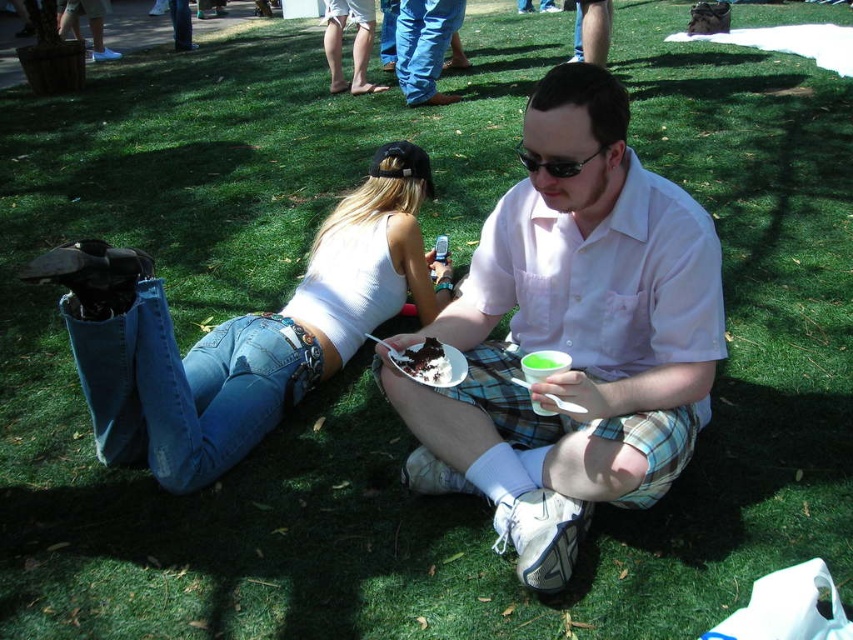
You are standing at the origin point of the coordinate system. You need to place a small picnic basket exactly at the midpoint between the denim jeans at lower left and another object. Which object should you choose to ensure the basket is placed correctly?

The denim jeans at lower left is located at point (248, 337). To find the midpoint between two points, you need to know the coordinates of both objects. However, the coordinates of the other object are not provided in the description. Therefore, it is impossible to determine the correct object for placing the picnic basket at the midpoint.